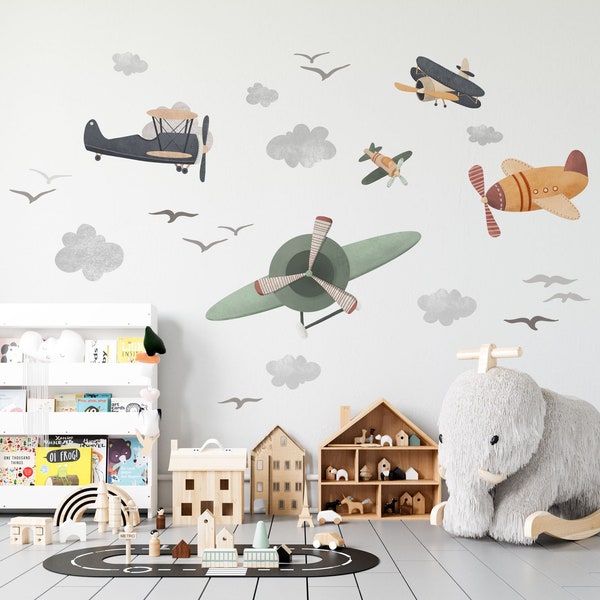
Locate an element on the screen. This screenshot has width=600, height=600. toy car is located at coordinates (322, 537), (326, 516).